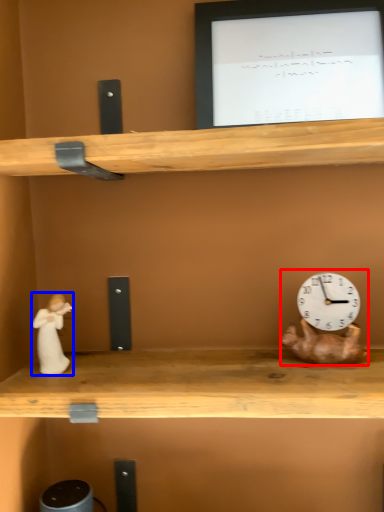
Question: Which object is closer to the camera taking this photo, toy (highlighted by a red box) or couple (highlighted by a blue box)?

Choices:
 (A) toy
 (B) couple

Answer: (A)